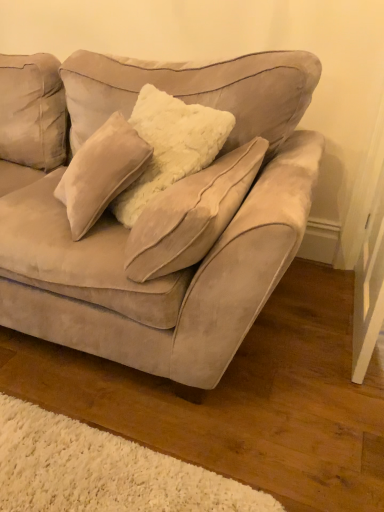
Question: From the image's perspective, relative to suede beige pillow at center, is suede couch at center above or below?

Choices:
 (A) above
 (B) below

Answer: (A)

Question: Is suede couch at center wider or thinner than suede beige pillow at center?

Choices:
 (A) wide
 (B) thin

Answer: (A)

Question: Considering the positions of point (114, 358) and point (142, 168), is point (114, 358) closer or farther from the camera than point (142, 168)?

Choices:
 (A) closer
 (B) farther

Answer: (B)

Question: Relative to suede couch at center, is suede beige pillow at center in front or behind?

Choices:
 (A) front
 (B) behind

Answer: (B)

Question: Is point click(64, 197) closer or farther from the camera than point click(281, 152)?

Choices:
 (A) closer
 (B) farther

Answer: (A)

Question: Do you think suede beige pillow at center is within suede couch at center, or outside of it?

Choices:
 (A) inside
 (B) outside

Answer: (A)

Question: From a real-world perspective, is suede beige pillow at center physically located above or below suede couch at center?

Choices:
 (A) above
 (B) below

Answer: (A)